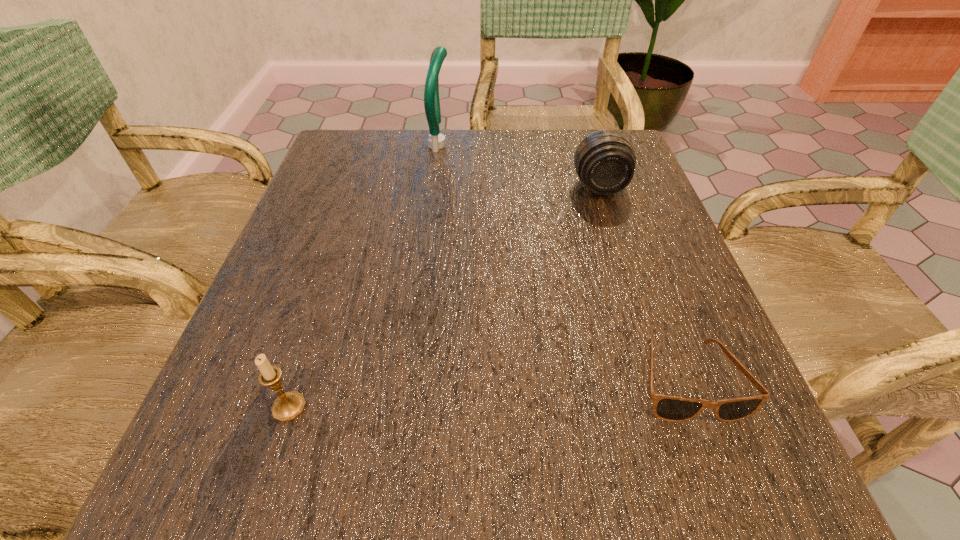
You are a GUI agent. You are given a task and a screenshot of the screen. Output one action in this format:
    pyautogui.click(x=<x>, y=<y>)
    Task: Click on the free area in between the leftmost object and the telephoto lens
    This screenshot has height=540, width=960.
    Given the screenshot: What is the action you would take?
    pyautogui.click(x=444, y=297)

Locate an element on the screen. The height and width of the screenshot is (540, 960). the third closest object relative to the tallest object is located at coordinates click(x=289, y=405).

Identify which object is the nearest to the shortest object. Please provide its 2D coordinates. Your answer should be formatted as a tuple, i.e. [(x, y)], where the tuple contains the x and y coordinates of a point satisfying the conditions above.

[(605, 161)]